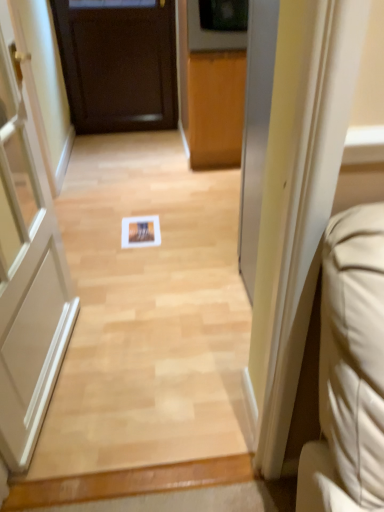
The width and height of the screenshot is (384, 512). I want to click on vacant space in front of dark wood door at center, the 1th door viewed from the back, so click(x=121, y=160).